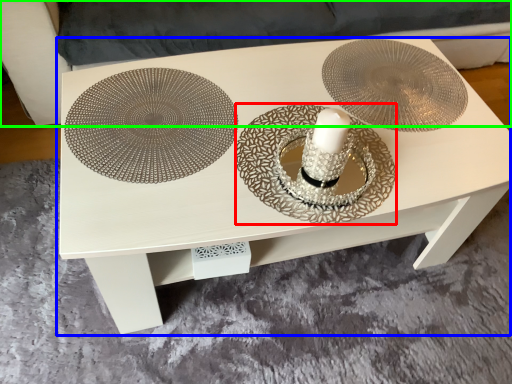
Question: Which object is the farthest from plate (highlighted by a red box)? Choose among these: table (highlighted by a blue box) or couch (highlighted by a green box).

Choices:
 (A) table
 (B) couch

Answer: (B)